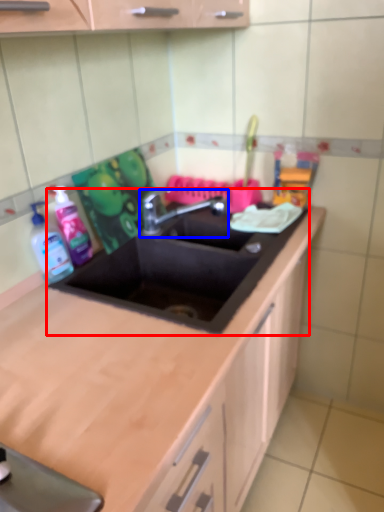
Question: Which object is further to the camera taking this photo, sink (highlighted by a red box) or tap (highlighted by a blue box)?

Choices:
 (A) sink
 (B) tap

Answer: (B)